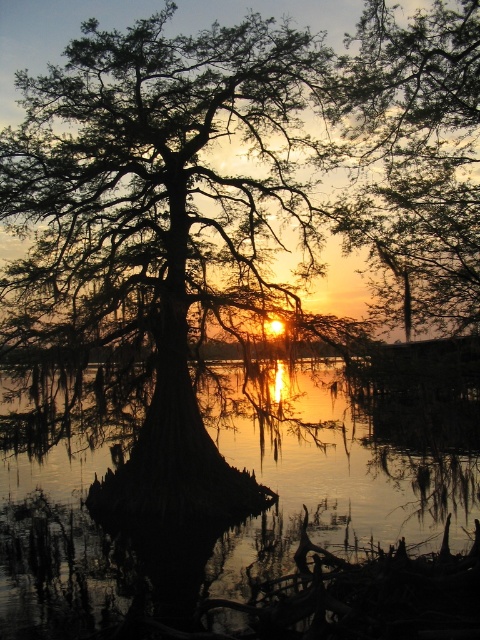
Question: Is silhouette wood cypress tree at center to the right of glossy reflective water at center from the viewer's perspective?

Choices:
 (A) no
 (B) yes

Answer: (A)

Question: From the image, what is the correct spatial relationship of silhouette wood cypress tree at center in relation to smooth bark tree at upper center?

Choices:
 (A) below
 (B) above

Answer: (A)

Question: Which object is positioned closest to the silhouette wood cypress tree at center?

Choices:
 (A) glossy reflective water at center
 (B) smooth bark tree at upper center

Answer: (A)

Question: Estimate the real-world distances between objects in this image. Which object is farther from the smooth bark tree at upper center?

Choices:
 (A) silhouette wood cypress tree at center
 (B) glossy reflective water at center

Answer: (B)

Question: Is glossy reflective water at center positioned in front of smooth bark tree at upper center?

Choices:
 (A) yes
 (B) no

Answer: (A)

Question: Which of the following is the closest to the observer?

Choices:
 (A) click(124, 200)
 (B) click(374, 125)
 (C) click(260, 445)

Answer: (B)